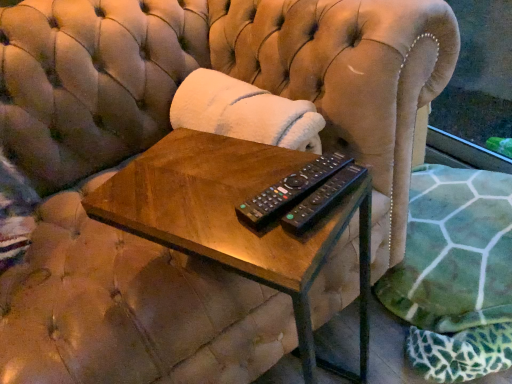
This screenshot has width=512, height=384. In order to click on vacant region to the left of black plastic remote at center, which appears as the 2th remote control when viewed from the front in this screenshot , I will do `click(198, 198)`.